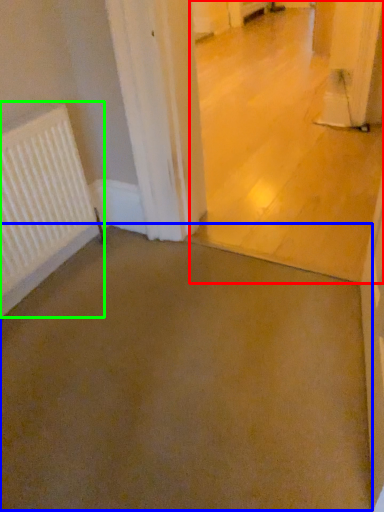
Question: Considering the real-world distances, which object is farthest from concrete (highlighted by a red box)? concrete (highlighted by a blue box) or radiator (highlighted by a green box)?

Choices:
 (A) concrete
 (B) radiator

Answer: (B)